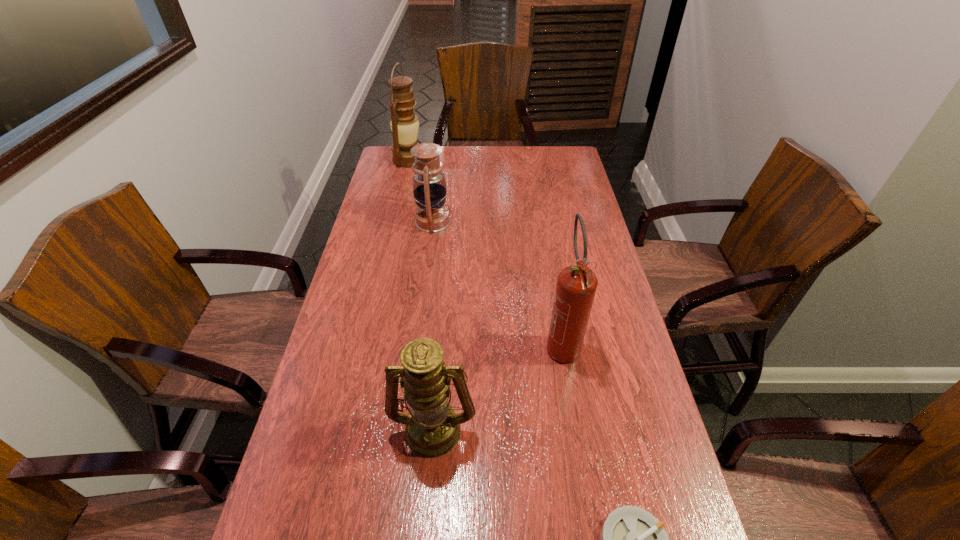
Locate an element on the screen. The image size is (960, 540). the farthest object is located at coordinates (404, 124).

You are a GUI agent. You are given a task and a screenshot of the screen. Output one action in this format:
    pyautogui.click(x=<x>, y=<y>)
    Task: Click on the leftmost object
    This screenshot has width=960, height=540.
    Given the screenshot: What is the action you would take?
    click(404, 124)

At what (x,y) coordinates should I click in order to perform the action: click on the third farthest object. Please return your answer as a coordinate pair (x, y). This screenshot has width=960, height=540. Looking at the image, I should click on point(576,286).

You are a GUI agent. You are given a task and a screenshot of the screen. Output one action in this format:
    pyautogui.click(x=<x>, y=<y>)
    Task: Click on the nearest oil lamp
    
    Given the screenshot: What is the action you would take?
    pos(432,428)

Find the location of a particular element. The image size is (960, 540). the fourth nearest object is located at coordinates (429, 186).

The width and height of the screenshot is (960, 540). I want to click on vacant space situated 0.290m on the front of the farthest object, so click(x=396, y=211).

Locate an element on the screen. vacant space located from the nozzle of the fire extinguisher is located at coordinates (580, 451).

Locate an element on the screen. This screenshot has width=960, height=540. free space located 0.250m on the back of the fourth farthest object is located at coordinates (442, 323).

At what (x,y) coordinates should I click in order to perform the action: click on vacant space located on the right of the second nearest oil lamp. Please return your answer as a coordinate pair (x, y). This screenshot has height=540, width=960. Looking at the image, I should click on (553, 221).

Where is `object at the far edge`? The width and height of the screenshot is (960, 540). object at the far edge is located at coordinates (404, 124).